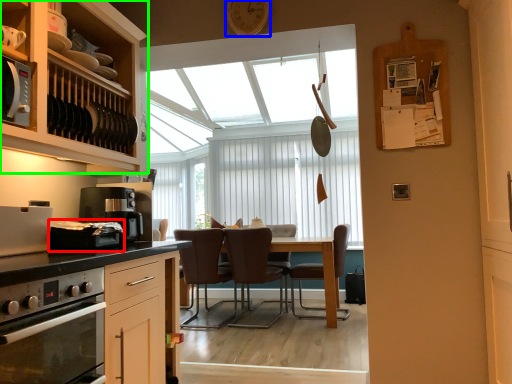
Question: Based on their relative distances, which object is farther from appliance (highlighted by a red box)? Choose from clock (highlighted by a blue box) and cabinetry (highlighted by a green box).

Choices:
 (A) clock
 (B) cabinetry

Answer: (A)